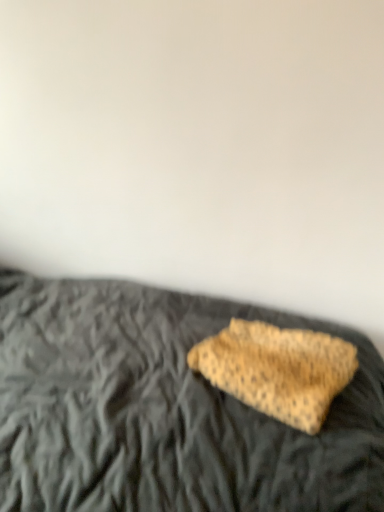
Question: Could you tell me if leopard print pillow at center is turned towards leopard print fabric at center?

Choices:
 (A) no
 (B) yes

Answer: (B)

Question: Is leopard print fabric at center a part of leopard print pillow at center?

Choices:
 (A) yes
 (B) no

Answer: (A)

Question: From the image's perspective, is leopard print pillow at center on top of leopard print fabric at center?

Choices:
 (A) no
 (B) yes

Answer: (A)

Question: Is leopard print pillow at center not within leopard print fabric at center?

Choices:
 (A) yes
 (B) no

Answer: (A)

Question: From a real-world perspective, is leopard print pillow at center physically above leopard print fabric at center?

Choices:
 (A) yes
 (B) no

Answer: (B)

Question: Can you see leopard print pillow at center touching leopard print fabric at center?

Choices:
 (A) yes
 (B) no

Answer: (B)

Question: From a real-world perspective, is leopard print fabric at center under leopard print pillow at center?

Choices:
 (A) no
 (B) yes

Answer: (A)

Question: Can you confirm if leopard print fabric at center is wider than leopard print pillow at center?

Choices:
 (A) no
 (B) yes

Answer: (A)

Question: Is leopard print fabric at center at the left side of leopard print pillow at center?

Choices:
 (A) no
 (B) yes

Answer: (A)

Question: From the image's perspective, is leopard print fabric at center on top of leopard print pillow at center?

Choices:
 (A) no
 (B) yes

Answer: (B)

Question: Can you confirm if leopard print fabric at center is positioned to the right of leopard print pillow at center?

Choices:
 (A) yes
 (B) no

Answer: (A)

Question: Is leopard print fabric at center taller than leopard print pillow at center?

Choices:
 (A) yes
 (B) no

Answer: (B)

Question: Visually, is leopard print fabric at center positioned to the left or to the right of leopard print pillow at center?

Choices:
 (A) right
 (B) left

Answer: (A)